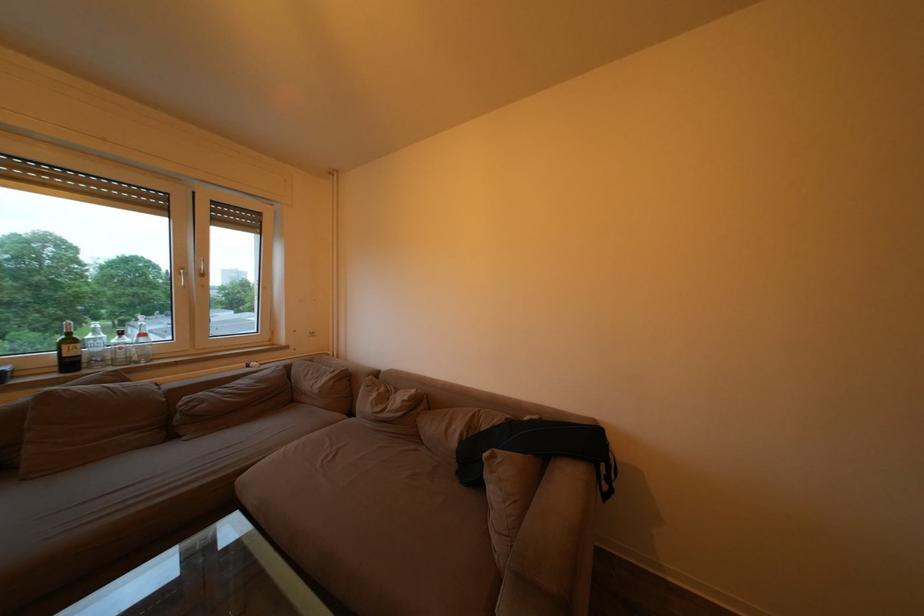
This screenshot has width=924, height=616. What are the coordinates of `sofa sitting surface` in the screenshot? It's located at (195, 454).